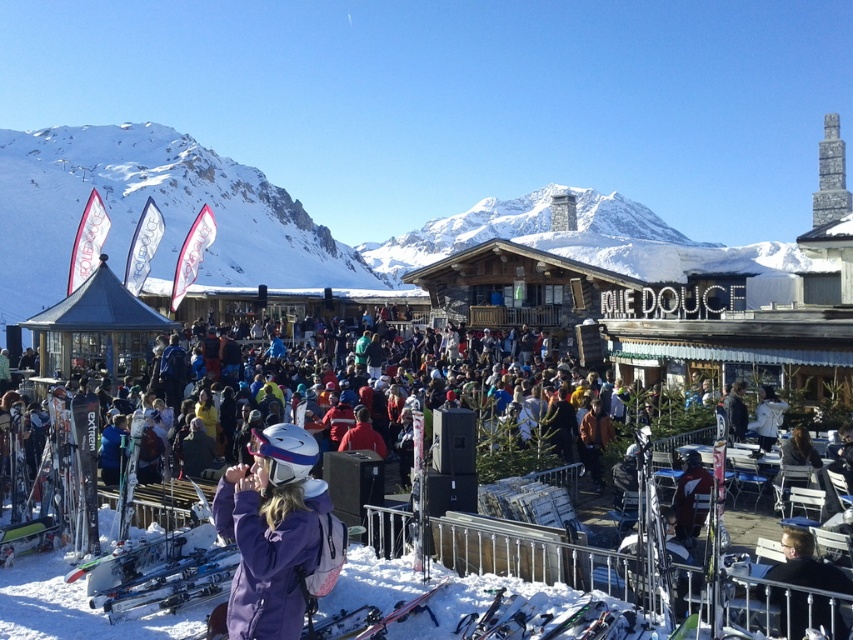
Does purple matte jacket at center appear on the right side of light brown leather jacket at lower right?

No, purple matte jacket at center is not to the right of light brown leather jacket at lower right.

Does point (300, 472) lie behind point (820, 564)?

That is True.

Locate an element on the screen. This screenshot has height=640, width=853. purple matte jacket at center is located at coordinates (271, 531).

Can you confirm if purple fabric jacket at center is positioned to the right of light brown leather jacket at lower right?

Incorrect, purple fabric jacket at center is not on the right side of light brown leather jacket at lower right.

Between purple fabric jacket at center and light brown leather jacket at lower right, which one appears on the left side from the viewer's perspective?

purple fabric jacket at center

Which is in front, point (457, 388) or point (845, 636)?

Point (845, 636) is in front.

Image resolution: width=853 pixels, height=640 pixels. What are the coordinates of `purple fabric jacket at center` in the screenshot? It's located at (460, 492).

Can you confirm if purple fabric jacket at center is positioned to the right of purple matte jacket at center?

Indeed, purple fabric jacket at center is positioned on the right side of purple matte jacket at center.

Who is higher up, purple fabric jacket at center or purple matte jacket at center?

purple fabric jacket at center is above.

Which is in front, point (422, 556) or point (305, 500)?

Point (305, 500) is in front.

Locate an element on the screen. This screenshot has height=640, width=853. purple fabric jacket at center is located at coordinates (460, 492).